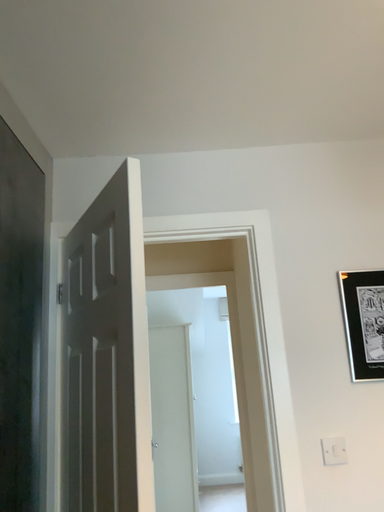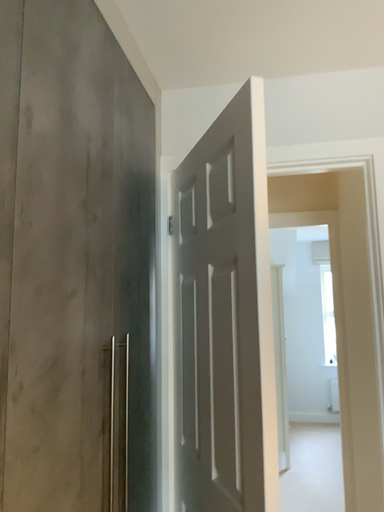
Question: How did the camera likely rotate when shooting the video?

Choices:
 (A) rotated left
 (B) rotated right

Answer: (A)